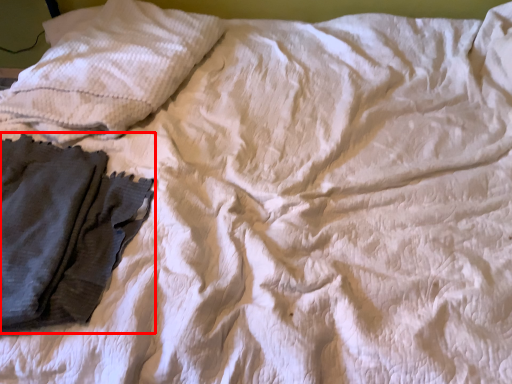
Question: From the image's perspective, what is the correct spatial positioning of garment (annotated by the red box) in reference to pillow?

Choices:
 (A) above
 (B) below

Answer: (B)